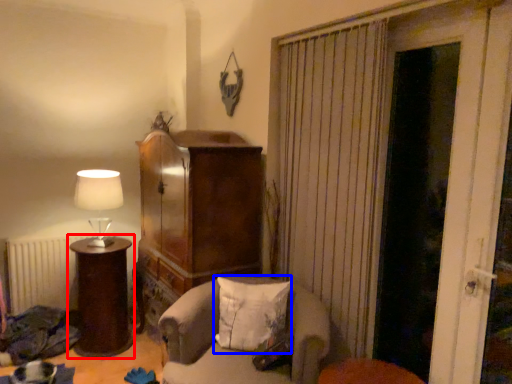
Question: Which point is closer to the camera, furniture (highlighted by a red box) or pillow (highlighted by a blue box)?

Choices:
 (A) furniture
 (B) pillow

Answer: (B)